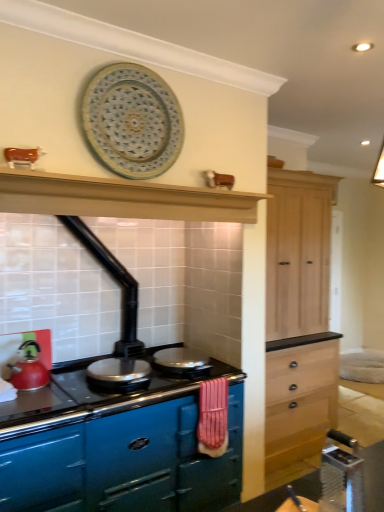
Question: From a real-world perspective, does glossy enamel stove at center sit lower than blue ceramic platter at upper center?

Choices:
 (A) yes
 (B) no

Answer: (A)

Question: Is glossy enamel stove at center turned away from blue ceramic platter at upper center?

Choices:
 (A) no
 (B) yes

Answer: (A)

Question: Is glossy enamel stove at center aimed at blue ceramic platter at upper center?

Choices:
 (A) no
 (B) yes

Answer: (A)

Question: Can you confirm if glossy enamel stove at center is positioned to the left of blue ceramic platter at upper center?

Choices:
 (A) no
 (B) yes

Answer: (B)

Question: Is glossy enamel stove at center taller than blue ceramic platter at upper center?

Choices:
 (A) yes
 (B) no

Answer: (A)

Question: In terms of size, does shiny metallic pan at center, the 1th appliance viewed from the left, appear bigger or smaller than glossy enamel stove at center?

Choices:
 (A) big
 (B) small

Answer: (B)

Question: Considering the positions of shiny metallic pan at center, the 1th appliance viewed from the left, and glossy enamel stove at center in the image, is shiny metallic pan at center, the 1th appliance viewed from the left, wider or thinner than glossy enamel stove at center?

Choices:
 (A) thin
 (B) wide

Answer: (A)

Question: In the image, is shiny metallic pan at center, which is the 2th appliance in right-to-left order, positioned in front of or behind glossy enamel stove at center?

Choices:
 (A) behind
 (B) front

Answer: (A)

Question: Visually, is shiny metallic pan at center, the 1th appliance viewed from the left, positioned to the left or to the right of glossy enamel stove at center?

Choices:
 (A) left
 (B) right

Answer: (B)

Question: Would you say shiny silver pan at center, the 2th appliance when ordered from left to right, is to the left or to the right of matte red kettle at left in the picture?

Choices:
 (A) left
 (B) right

Answer: (B)

Question: In terms of size, does shiny silver pan at center, the 2th appliance when ordered from left to right, appear bigger or smaller than matte red kettle at left?

Choices:
 (A) small
 (B) big

Answer: (A)

Question: From a real-world perspective, is shiny silver pan at center, marked as the 1th appliance in a right-to-left arrangement, positioned above or below matte red kettle at left?

Choices:
 (A) above
 (B) below

Answer: (B)

Question: Considering the positions of shiny silver pan at center, marked as the 1th appliance in a right-to-left arrangement, and matte red kettle at left in the image, is shiny silver pan at center, marked as the 1th appliance in a right-to-left arrangement, wider or thinner than matte red kettle at left?

Choices:
 (A) wide
 (B) thin

Answer: (A)

Question: Is matte red kettle at left taller or shorter than blue ceramic platter at upper center?

Choices:
 (A) short
 (B) tall

Answer: (A)

Question: Is point (44, 373) positioned closer to the camera than point (84, 115)?

Choices:
 (A) farther
 (B) closer

Answer: (A)